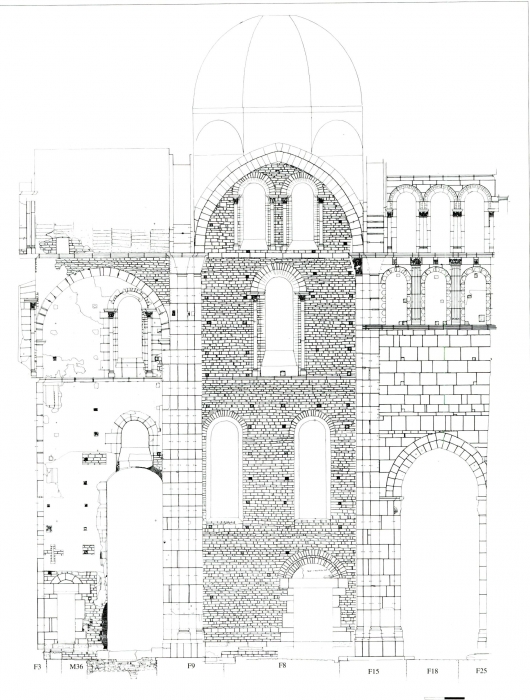
At what (x,y) coordinates should I click in order to perform the action: click on top of doorway. Please return your answer as a coordinate pair (x, y). Looking at the image, I should click on (436, 439).